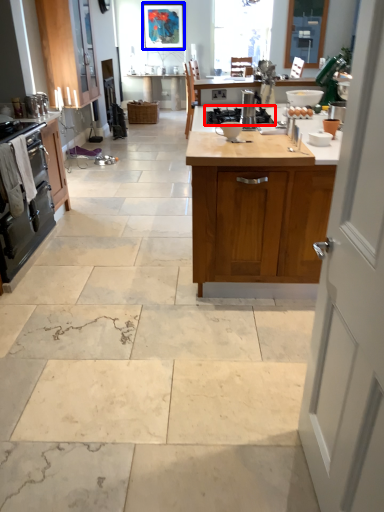
Question: Among these objects, which one is farthest to the camera, gas stove (highlighted by a red box) or picture frame (highlighted by a blue box)?

Choices:
 (A) gas stove
 (B) picture frame

Answer: (B)